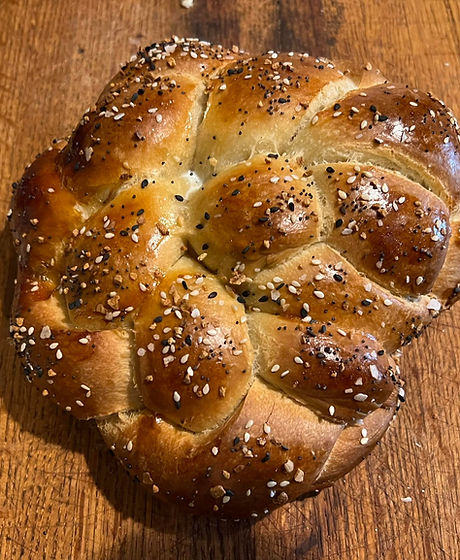
Where is `open brown space on tabletop upper right corner`? This screenshot has width=460, height=560. open brown space on tabletop upper right corner is located at coordinates pos(432,62), pos(391,28).